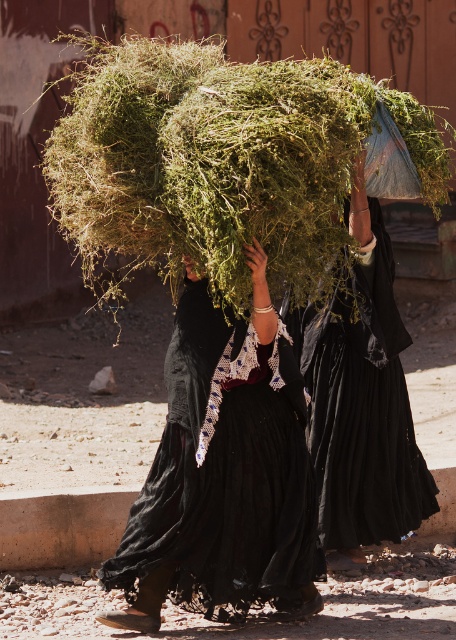
Question: Does green grassy hay at center come in front of black fabric dress at center?

Choices:
 (A) no
 (B) yes

Answer: (B)

Question: Estimate the real-world distances between objects in this image. Which object is closer to the green grassy hay at center?

Choices:
 (A) black fabric dress at center
 (B) black matte dress at center

Answer: (A)

Question: Considering the real-world distances, which object is closest to the black fabric dress at center?

Choices:
 (A) black matte dress at center
 (B) green grassy hay at center

Answer: (A)

Question: Is green grassy hay at center bigger than black matte dress at center?

Choices:
 (A) yes
 (B) no

Answer: (B)

Question: Considering the real-world distances, which object is farthest from the black matte dress at center?

Choices:
 (A) green grassy hay at center
 (B) black fabric dress at center

Answer: (A)

Question: Does green grassy hay at center appear on the right side of black fabric dress at center?

Choices:
 (A) no
 (B) yes

Answer: (B)